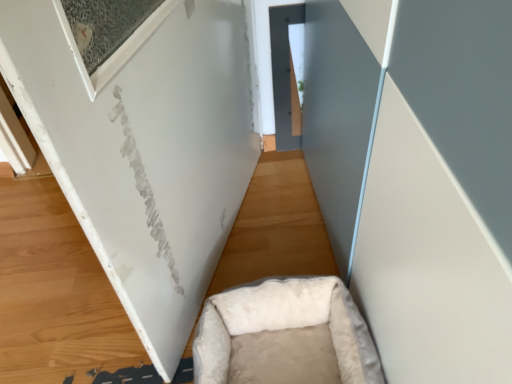
The height and width of the screenshot is (384, 512). What are the coordinates of `white plush pet bed at lower center` in the screenshot? It's located at (285, 335).

The width and height of the screenshot is (512, 384). What do you see at coordinates (285, 335) in the screenshot?
I see `white plush pet bed at lower center` at bounding box center [285, 335].

What do you see at coordinates (55, 294) in the screenshot? I see `white fluffy pet bed at lower center` at bounding box center [55, 294].

Find the location of `white fluffy pet bed at lower center`. white fluffy pet bed at lower center is located at coordinates (55, 294).

What is the approximate height of white fluffy pet bed at lower center?

It is 2.52 centimeters.

Image resolution: width=512 pixels, height=384 pixels. What are the coordinates of `white plush pet bed at lower center` in the screenshot? It's located at (285, 335).

Between white fluffy pet bed at lower center and white plush pet bed at lower center, which one appears on the left side from the viewer's perspective?

Positioned to the left is white fluffy pet bed at lower center.

Is white fluffy pet bed at lower center further to the viewer compared to white plush pet bed at lower center?

Yes, white fluffy pet bed at lower center is further from the camera.

Which is less distant, (x=106, y=290) or (x=230, y=355)?

Point (x=106, y=290) is positioned farther from the camera compared to point (x=230, y=355).

From the image's perspective, which one is positioned higher, white fluffy pet bed at lower center or white plush pet bed at lower center?

white fluffy pet bed at lower center.

Consider the image. From a real-world perspective, is white fluffy pet bed at lower center over white plush pet bed at lower center?

No, from a real-world perspective, white fluffy pet bed at lower center is not on top of white plush pet bed at lower center.

Considering the sizes of objects white fluffy pet bed at lower center and white plush pet bed at lower center in the image provided, who is wider, white fluffy pet bed at lower center or white plush pet bed at lower center?

white fluffy pet bed at lower center is wider.

Can you confirm if white fluffy pet bed at lower center is shorter than white plush pet bed at lower center?

Yes.

Based on their sizes in the image, would you say white fluffy pet bed at lower center is bigger or smaller than white plush pet bed at lower center?

white fluffy pet bed at lower center is bigger than white plush pet bed at lower center.

Do you think white fluffy pet bed at lower center is within white plush pet bed at lower center, or outside of it?

white fluffy pet bed at lower center is outside white plush pet bed at lower center.

Is white fluffy pet bed at lower center not close to white plush pet bed at lower center?

No, white fluffy pet bed at lower center is not far from white plush pet bed at lower center.

Is white fluffy pet bed at lower center turned away from white plush pet bed at lower center?

No, white fluffy pet bed at lower center is not facing away from white plush pet bed at lower center.

This screenshot has width=512, height=384. Identify the location of plywood that is under the white plush pet bed at lower center (from a real-world perspective). (55, 294).

Does white plush pet bed at lower center appear on the right side of white fluffy pet bed at lower center?

Yes, white plush pet bed at lower center is to the right of white fluffy pet bed at lower center.

Does white plush pet bed at lower center come behind white fluffy pet bed at lower center?

No, white plush pet bed at lower center is closer to the camera.

Does point (290, 299) lie in front of point (287, 265)?

Yes, it is.

From the image's perspective, is white plush pet bed at lower center positioned above or below white fluffy pet bed at lower center?

white plush pet bed at lower center is below white fluffy pet bed at lower center.

From a real-world perspective, is white plush pet bed at lower center on top of white fluffy pet bed at lower center?

Indeed, from a real-world perspective, white plush pet bed at lower center stands above white fluffy pet bed at lower center.

Which of these two, white plush pet bed at lower center or white fluffy pet bed at lower center, is thinner?

white plush pet bed at lower center.

Does white plush pet bed at lower center have a lesser height compared to white fluffy pet bed at lower center?

Incorrect, the height of white plush pet bed at lower center does not fall short of that of white fluffy pet bed at lower center.

Is white plush pet bed at lower center bigger than white fluffy pet bed at lower center?

No, white plush pet bed at lower center is not bigger than white fluffy pet bed at lower center.

Is white plush pet bed at lower center inside or outside of white fluffy pet bed at lower center?

white plush pet bed at lower center is spatially situated outside white fluffy pet bed at lower center.

Is white plush pet bed at lower center far away from white fluffy pet bed at lower center?

No.

Is white plush pet bed at lower center facing towards white fluffy pet bed at lower center?

No, white plush pet bed at lower center does not turn towards white fluffy pet bed at lower center.

What's the angular difference between white plush pet bed at lower center and white fluffy pet bed at lower center's facing directions?

The angular difference between white plush pet bed at lower center and white fluffy pet bed at lower center is 91.3 degrees.

Locate an element on the screen. The width and height of the screenshot is (512, 384). furniture that is in front of the white fluffy pet bed at lower center is located at coordinates (285, 335).

Where is `plywood above the white plush pet bed at lower center (from the image's perspective)`? This screenshot has height=384, width=512. plywood above the white plush pet bed at lower center (from the image's perspective) is located at coordinates (55, 294).

What are the coordinates of `furniture located on the right of white fluffy pet bed at lower center` in the screenshot? It's located at (285, 335).